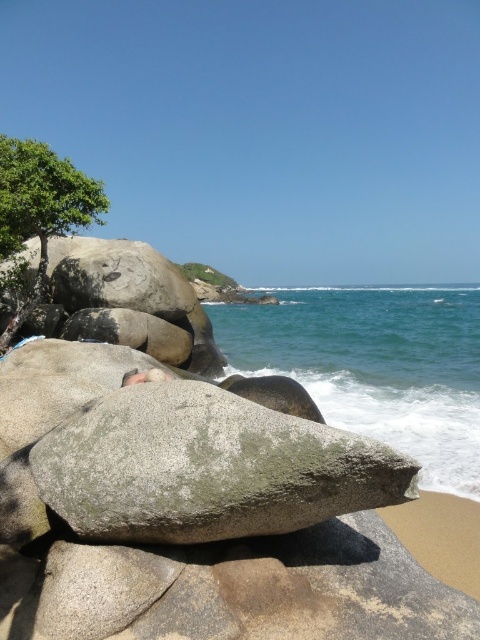
Question: From the image, what is the correct spatial relationship of gray granite rock at center in relation to green leafy tree at upper left?

Choices:
 (A) right
 (B) left

Answer: (A)

Question: Which point is closer to the camera?

Choices:
 (A) (453, 404)
 (B) (252, 460)

Answer: (B)

Question: Does gray granite rock at center come in front of green leafy tree at upper left?

Choices:
 (A) no
 (B) yes

Answer: (B)

Question: Can you confirm if blue-green water at center is positioned below green leafy tree at upper left?

Choices:
 (A) no
 (B) yes

Answer: (B)

Question: Which is nearer to the green leafy tree at upper left?

Choices:
 (A) blue-green water at center
 (B) gray granite rock at center

Answer: (B)

Question: Which point is closer to the camera?

Choices:
 (A) gray granite rock at center
 (B) blue-green water at center
 (C) green leafy tree at upper left

Answer: (A)